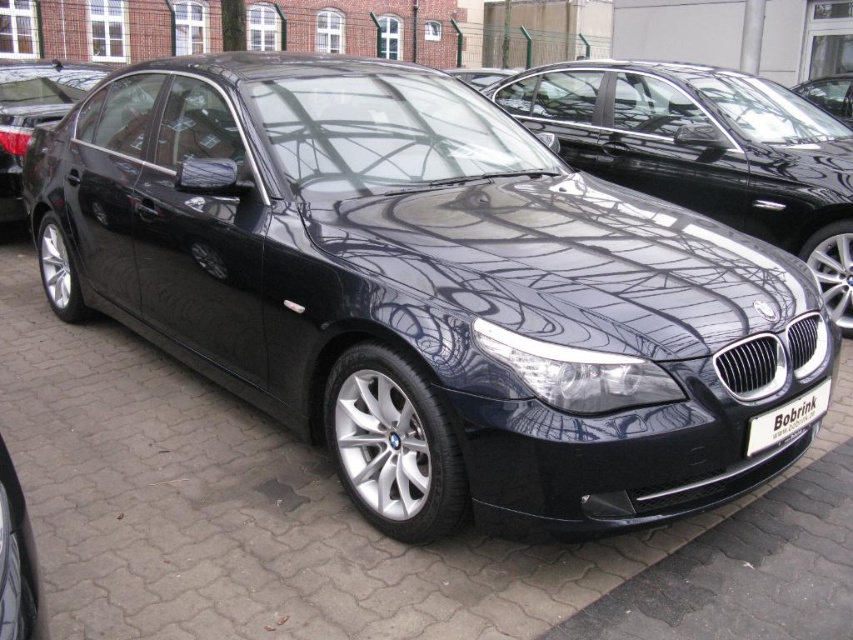
Question: Does glossy black car at center appear over white plastic license plate at center?

Choices:
 (A) yes
 (B) no

Answer: (A)

Question: Can you confirm if glossy black car at lower left is thinner than white plastic license plate at center?

Choices:
 (A) no
 (B) yes

Answer: (B)

Question: Which object appears closest to the camera in this image?

Choices:
 (A) glossy black car at lower left
 (B) glossy black car at center

Answer: (A)

Question: Which object is the farthest from the glossy black car at lower left?

Choices:
 (A) glossy black car at center
 (B) white plastic license plate at center

Answer: (A)

Question: Which object is the farthest from the glossy black car at center?

Choices:
 (A) white plastic license plate at center
 (B) glossy black car at lower left

Answer: (B)

Question: Does glossy black car at center have a larger size compared to glossy black car at lower left?

Choices:
 (A) yes
 (B) no

Answer: (A)